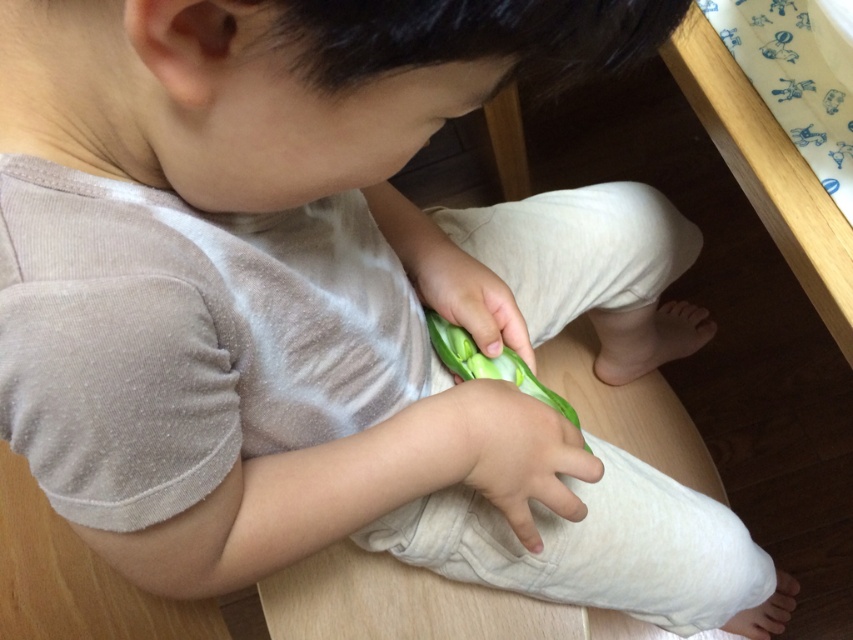
You are a parent trying to give your child a green matte flower at center. The child is currently holding a green rubber toy at center. Can you place the flower on top of the toy without moving the toy?

The green rubber toy at center is positioned under green matte flower at center, so yes, you can place the flower on top of the toy without moving it.

You are a photographer trying to capture a closeup of the green matte flower at center. If your camera is set to focus at 25 inches, will the flower be in focus?

The green matte flower at center and camera are 25.22 inches apart from each other, which is slightly beyond the 25 inches focus setting. Therefore, the flower may not be in perfect focus.

The child is holding a green rubber toy at center and has a white soft hand at lower right. Which object is wider?

The white soft hand at lower right is wider than the green rubber toy at center.